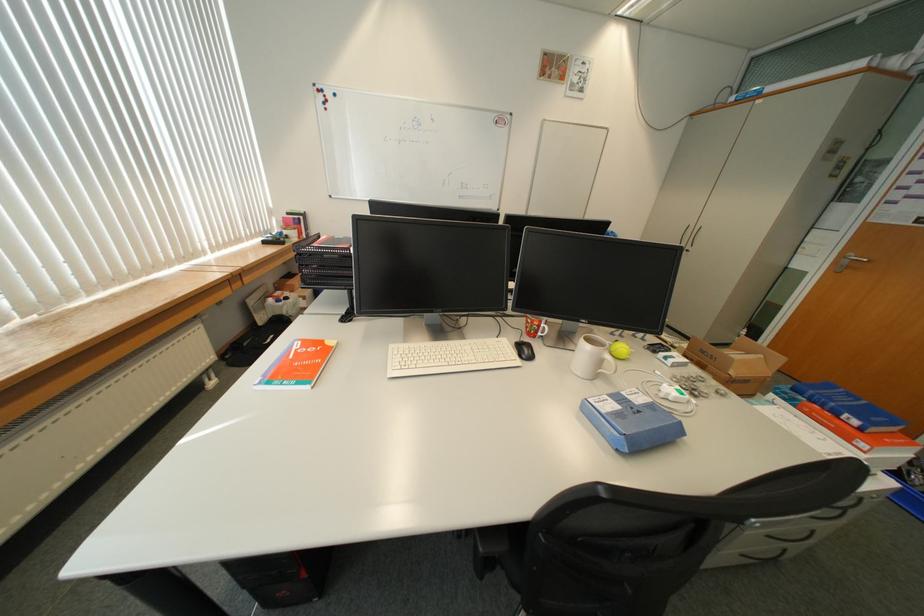
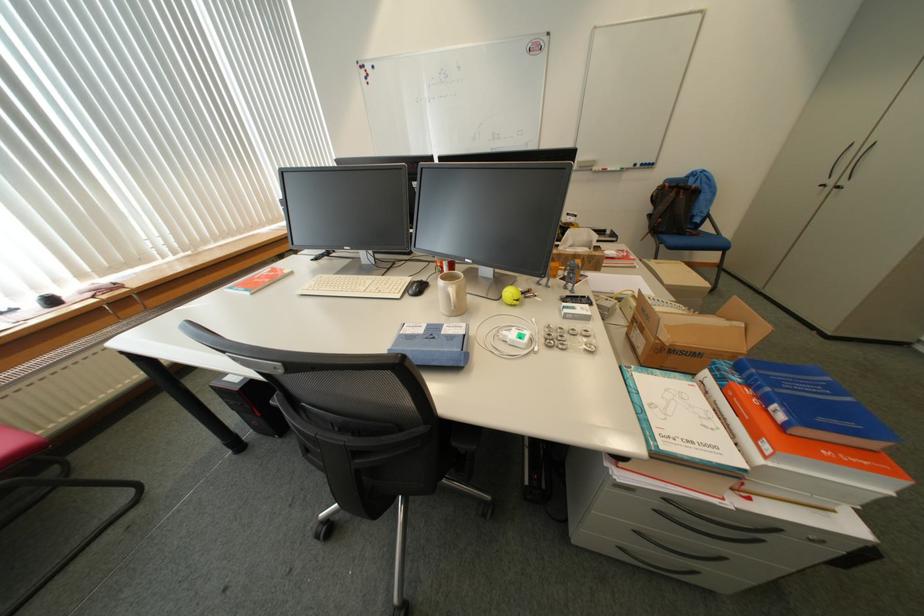
Where in the second image is the point corresponding to point (871, 446) from the first image?

(775, 448)